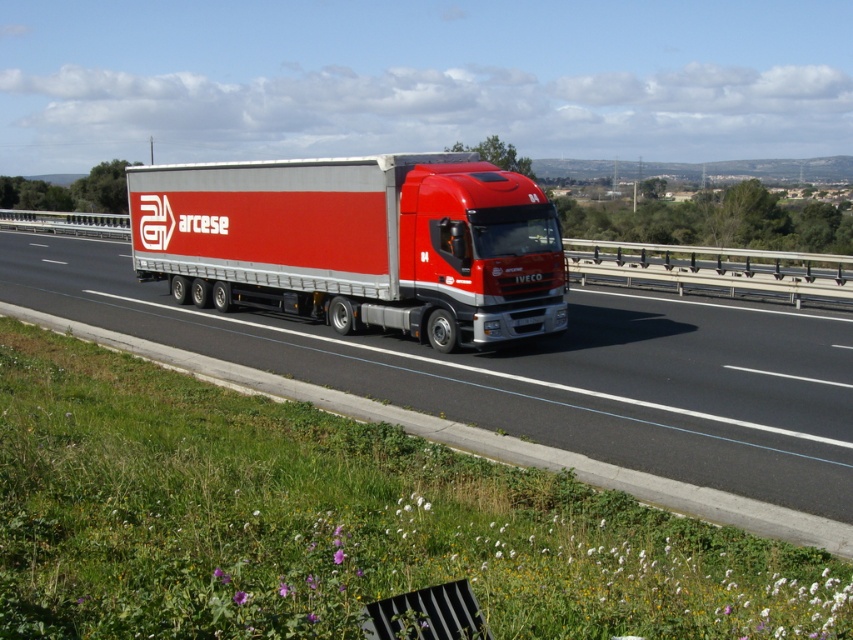
Between metallic silver truck at center and metallic silver trailer truck at center, which one has more height?

Standing taller between the two is metallic silver trailer truck at center.

Is metallic silver truck at center wider than metallic silver trailer truck at center?

Yes, metallic silver truck at center is wider than metallic silver trailer truck at center.

Is point (798, 410) more distant than point (312, 218)?

No.

Where is `metallic silver truck at center`? Image resolution: width=853 pixels, height=640 pixels. metallic silver truck at center is located at coordinates (537, 372).